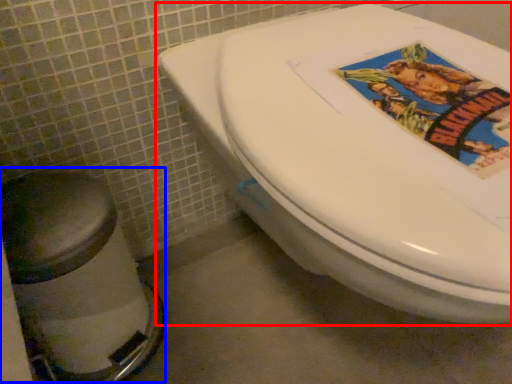
Question: Which of the following is the closest to the observer, toilet (highlighted by a red box) or bidet (highlighted by a blue box)?

Choices:
 (A) toilet
 (B) bidet

Answer: (A)